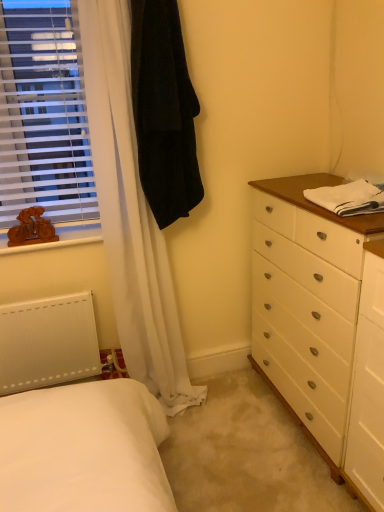
Question: Considering the relative positions of white plastic blinds at left and wooden figure at left in the image provided, is white plastic blinds at left to the right of wooden figure at left from the viewer's perspective?

Choices:
 (A) no
 (B) yes

Answer: (B)

Question: From a real-world perspective, is white plastic blinds at left under wooden figure at left?

Choices:
 (A) yes
 (B) no

Answer: (B)

Question: Is white plastic blinds at left surrounding wooden figure at left?

Choices:
 (A) yes
 (B) no

Answer: (B)

Question: From the image's perspective, does white plastic blinds at left appear lower than wooden figure at left?

Choices:
 (A) yes
 (B) no

Answer: (B)

Question: From a real-world perspective, is white plastic blinds at left located higher than wooden figure at left?

Choices:
 (A) yes
 (B) no

Answer: (A)

Question: From a real-world perspective, is white plastic blinds at left above or below black velvet robe at upper left?

Choices:
 (A) above
 (B) below

Answer: (A)

Question: Considering the relative positions of white plastic blinds at left and black velvet robe at upper left in the image provided, is white plastic blinds at left to the left or to the right of black velvet robe at upper left?

Choices:
 (A) left
 (B) right

Answer: (A)

Question: Is white plastic blinds at left in front of or behind black velvet robe at upper left in the image?

Choices:
 (A) behind
 (B) front

Answer: (A)

Question: Is white plastic blinds at left spatially inside black velvet robe at upper left, or outside of it?

Choices:
 (A) inside
 (B) outside

Answer: (B)

Question: From their relative heights in the image, would you say white plastic blinds at left is taller or shorter than white cotton towel at right?

Choices:
 (A) short
 (B) tall

Answer: (B)

Question: From the image's perspective, is white plastic blinds at left above or below white cotton towel at right?

Choices:
 (A) above
 (B) below

Answer: (A)

Question: Do you think white plastic blinds at left is within white cotton towel at right, or outside of it?

Choices:
 (A) inside
 (B) outside

Answer: (B)

Question: Does point (54, 101) appear closer or farther from the camera than point (311, 198)?

Choices:
 (A) closer
 (B) farther

Answer: (B)

Question: Is black velvet robe at upper left to the left or to the right of white plastic blinds at left in the image?

Choices:
 (A) right
 (B) left

Answer: (A)

Question: Looking at their shapes, would you say black velvet robe at upper left is wider or thinner than white plastic blinds at left?

Choices:
 (A) thin
 (B) wide

Answer: (B)